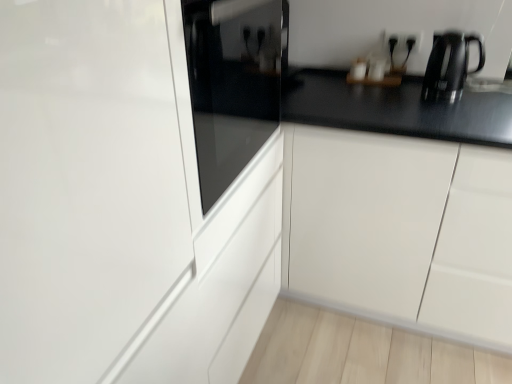
At what (x,y) coordinates should I click in order to perform the action: click on vacant space underneath black metallic kettle at upper right (from a real-world perspective). Please return your answer as a coordinate pair (x, y). The image size is (512, 384). Looking at the image, I should click on (460, 99).